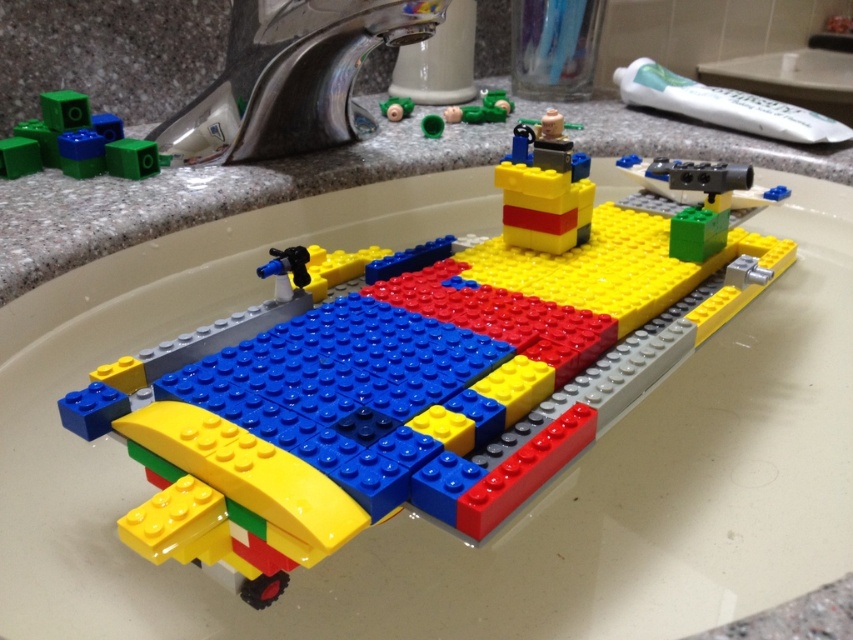
Question: Is yellow matte lego plane at center positioned in front of green matte cube at upper left?

Choices:
 (A) yes
 (B) no

Answer: (A)

Question: Among these points, which one is farthest from the camera?

Choices:
 (A) tap(392, 120)
 (B) tap(456, 115)

Answer: (A)

Question: Considering the relative positions of green matte cube at upper left and matte green plastic toy at upper center in the image provided, where is green matte cube at upper left located with respect to matte green plastic toy at upper center?

Choices:
 (A) above
 (B) below

Answer: (B)

Question: Which point appears farthest from the camera in this image?

Choices:
 (A) (120, 128)
 (B) (357, 436)
 (C) (445, 113)
 (D) (379, 108)

Answer: (D)

Question: Can you confirm if yellow matte lego plane at center is positioned below green matte toy at upper center?

Choices:
 (A) no
 (B) yes

Answer: (B)

Question: Which point is farther to the camera?

Choices:
 (A) yellow matte lego plane at center
 (B) matte green plastic toy at upper center
 (C) silver metallic faucet at upper left
 (D) green matte toy at upper center

Answer: (D)